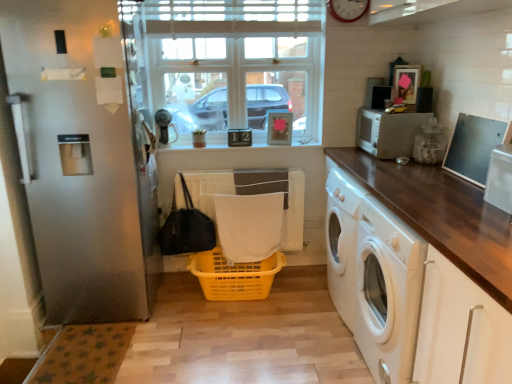
At what (x,y) coordinates should I click in order to perform the action: click on spots to the right of yellow plastic basket at center. Please return your answer as a coordinate pair (x, y). Looking at the image, I should click on (309, 308).